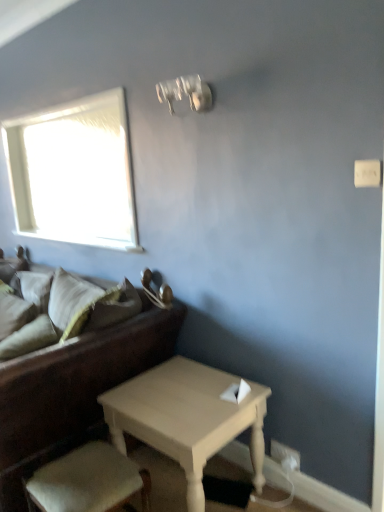
Question: Would you consider light beige fabric armchair at lower left to be distant from soft beige pillow at left, marked as the 2th pillow in a back-to-front arrangement?

Choices:
 (A) yes
 (B) no

Answer: (B)

Question: Can you confirm if light beige fabric armchair at lower left is positioned to the right of soft beige pillow at left, the 1th pillow in the front-to-back sequence?

Choices:
 (A) no
 (B) yes

Answer: (B)

Question: Considering the relative sizes of light beige fabric armchair at lower left and soft beige pillow at left, the 1th pillow in the front-to-back sequence, in the image provided, is light beige fabric armchair at lower left smaller than soft beige pillow at left, the 1th pillow in the front-to-back sequence,?

Choices:
 (A) yes
 (B) no

Answer: (B)

Question: From a real-world perspective, is light beige fabric armchair at lower left below soft beige pillow at left, marked as the 2th pillow in a back-to-front arrangement?

Choices:
 (A) no
 (B) yes

Answer: (B)

Question: From the image's perspective, is light beige fabric armchair at lower left beneath soft beige pillow at left, marked as the 2th pillow in a back-to-front arrangement?

Choices:
 (A) no
 (B) yes

Answer: (B)

Question: In terms of height, does light beige fabric armchair at lower left look taller or shorter compared to soft beige pillow at left, which ranks as the 2th pillow in front-to-back order?

Choices:
 (A) tall
 (B) short

Answer: (B)

Question: Relative to soft beige pillow at left, which ranks as the 2th pillow in front-to-back order, is light beige fabric armchair at lower left in front or behind?

Choices:
 (A) behind
 (B) front

Answer: (B)

Question: Considering the relative positions of light beige fabric armchair at lower left and soft beige pillow at left, which ranks as the 2th pillow in front-to-back order, in the image provided, is light beige fabric armchair at lower left to the left or to the right of soft beige pillow at left, which ranks as the 2th pillow in front-to-back order,?

Choices:
 (A) left
 (B) right

Answer: (B)

Question: Is light beige fabric armchair at lower left situated inside soft beige pillow at left, which ranks as the 2th pillow in front-to-back order, or outside?

Choices:
 (A) outside
 (B) inside

Answer: (A)

Question: Choose the correct answer: Is soft beige pillow at left, which ranks as the 2th pillow in front-to-back order, inside light beige fabric armchair at lower left or outside it?

Choices:
 (A) inside
 (B) outside

Answer: (B)

Question: Is soft beige pillow at left, which ranks as the 2th pillow in front-to-back order, taller or shorter than light beige fabric armchair at lower left?

Choices:
 (A) tall
 (B) short

Answer: (A)

Question: Considering the positions of soft beige pillow at left, which appears as the first pillow when viewed from the back, and light beige fabric armchair at lower left in the image, is soft beige pillow at left, which appears as the first pillow when viewed from the back, wider or thinner than light beige fabric armchair at lower left?

Choices:
 (A) wide
 (B) thin

Answer: (B)

Question: In the image, is soft beige pillow at left, which appears as the first pillow when viewed from the back, on the left side or the right side of light beige fabric armchair at lower left?

Choices:
 (A) right
 (B) left

Answer: (B)

Question: From the image's perspective, is soft beige pillow at left, the 1th pillow in the front-to-back sequence, located above or below light beige fabric armchair at lower left?

Choices:
 (A) above
 (B) below

Answer: (A)

Question: Considering the positions of soft beige pillow at left, marked as the 2th pillow in a back-to-front arrangement, and light beige fabric armchair at lower left in the image, is soft beige pillow at left, marked as the 2th pillow in a back-to-front arrangement, bigger or smaller than light beige fabric armchair at lower left?

Choices:
 (A) big
 (B) small

Answer: (B)